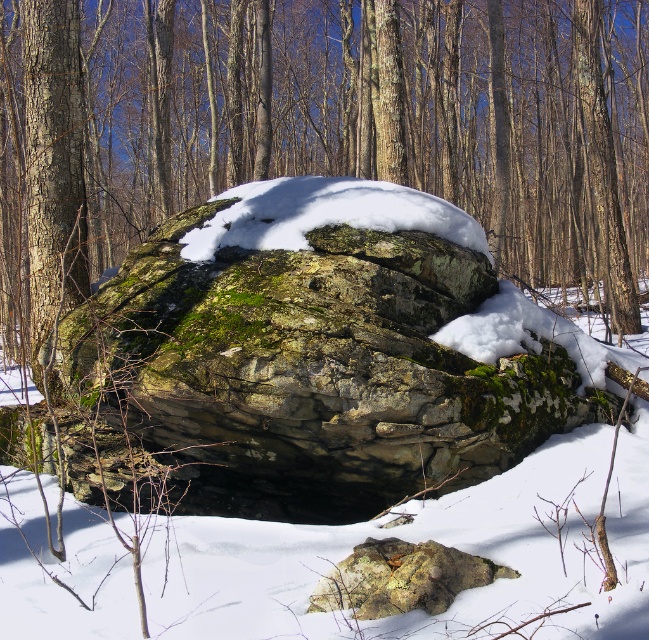
Question: Does green mossy rock at center appear over green mossy rock at lower center?

Choices:
 (A) yes
 (B) no

Answer: (A)

Question: Which of the following is the closest to the observer?

Choices:
 (A) green mossy rock at center
 (B) green mossy rock at lower center

Answer: (B)

Question: Does green mossy rock at center have a lesser width compared to green mossy rock at lower center?

Choices:
 (A) yes
 (B) no

Answer: (B)

Question: Which point is farther from the camera taking this photo?

Choices:
 (A) (589, 349)
 (B) (376, 566)

Answer: (A)

Question: Which of the following is the farthest from the observer?

Choices:
 (A) (204, 458)
 (B) (350, 566)

Answer: (A)

Question: Does green mossy rock at center appear under green mossy rock at lower center?

Choices:
 (A) yes
 (B) no

Answer: (B)